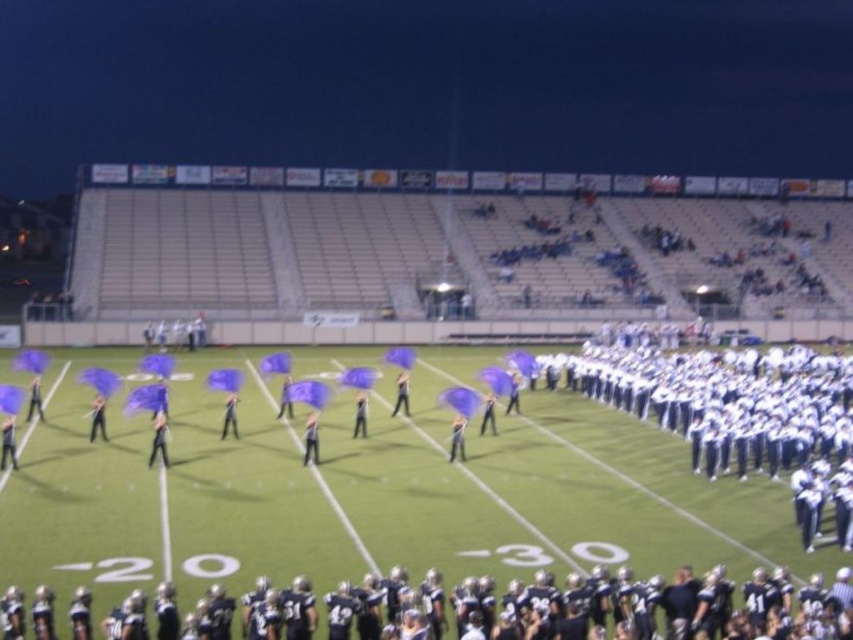
You are a photographer standing at the edge of the football field. You want to take a photo that includes both the black uniformed players at lower center and the white uniformed football team at center. Which group will appear larger in your photo?

The black uniformed players at lower center will appear larger in the photo because they are closer to the viewer than the white uniformed football team at center.

You are a photographer standing at the center of the stadium field. You need to capture a photo of the black uniformed players at lower center. According to their position, where should you aim your camera?

The black uniformed players at lower center are located at point 0.950 on the x axis and 0.776 on the y axis. To capture them, aim your camera towards the lower center area of the stadium field, specifically at coordinates x 0.950 and y 0.776.